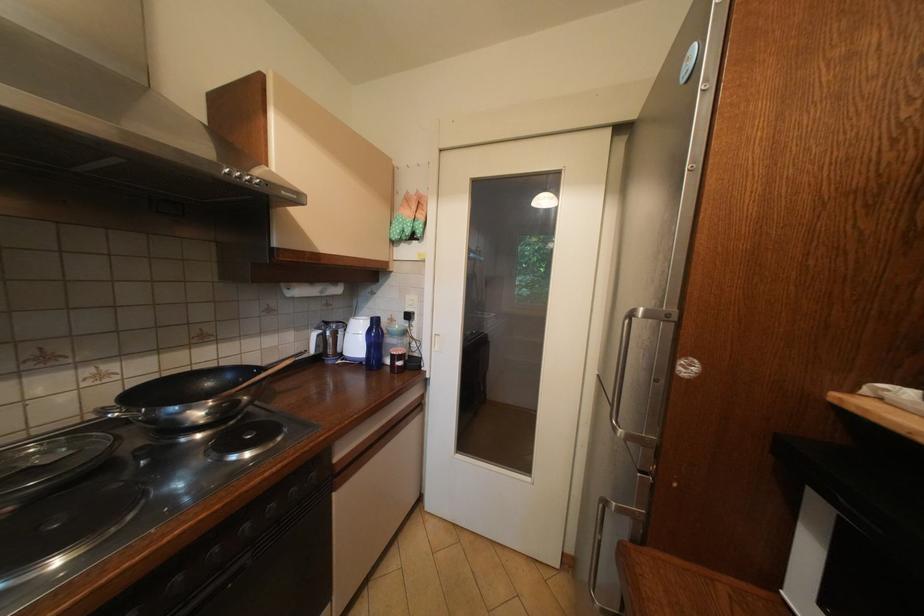
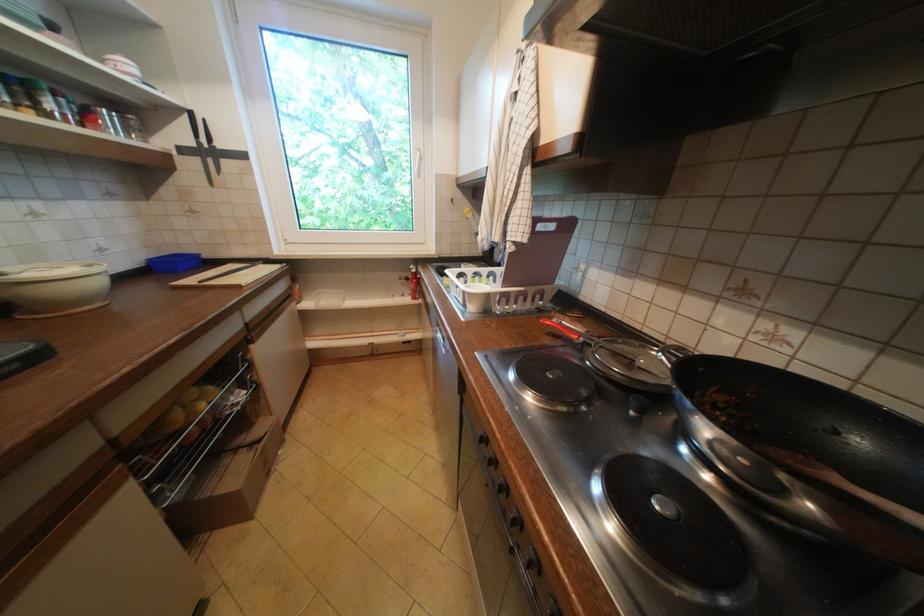
Where in the second image is the point corresponding to [205,416] from the first image?

(715, 430)